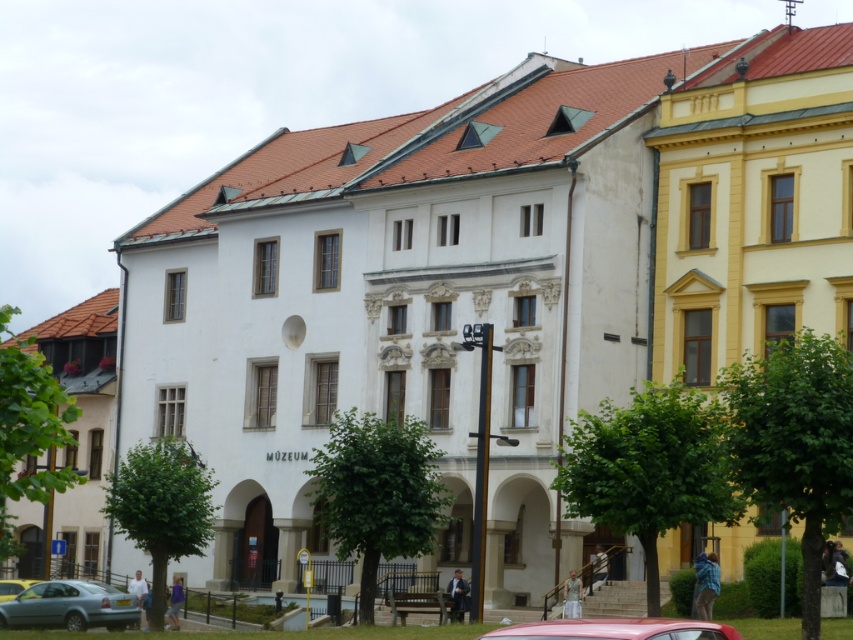
You are a pedestrian standing in front of the classical building and see the metallic pink car at lower center and the metallic silver car at lower left. Which car is closer to the building?

The metallic silver car at lower left is closer to the building because it is positioned below the metallic pink car at lower center, which is located above it.

You are standing in front of the classical building and want to take a photo of both the metallic pink car at lower center and the metallic silver car at lower left. Which car should you move towards to get both in the frame without zooming?

You should move towards the metallic silver car at lower left because the metallic pink car at lower center is closer to the viewer, so moving towards the farther car will help balance their positions in the frame.

You are a delivery person needing to park your vehicle in the parking spot next to the light blue metallic car at lower left. Can your standard delivery van, which is larger than the metallic pink car at lower center, fit in that parking spot?

The parking spot next to the light blue metallic car at lower left can only accommodate vehicles that are smaller than or equal to the size of the metallic pink car at lower center. Since your delivery van is larger than the metallic pink car at lower center, it will not fit in that parking spot.